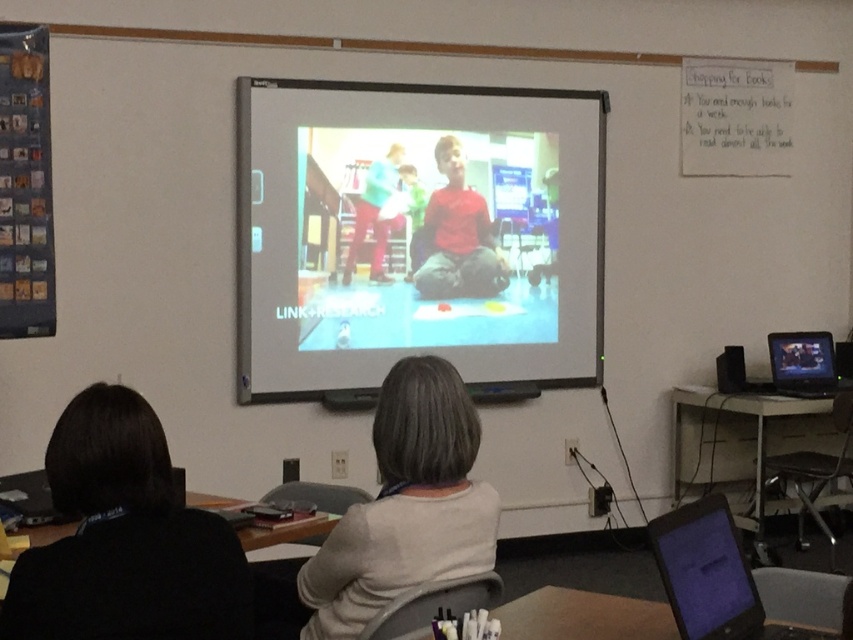
Is point (805, 634) closer to viewer compared to point (374, 180)?

Yes, it is.

Is point (723, 547) farther from camera compared to point (369, 209)?

No, it is in front of (369, 209).

Locate an element on the screen. black glossy laptop at lower right is located at coordinates (712, 577).

Is matte projector screen at center thinner than black glossy laptop at lower right?

No.

Where is `matte projector screen at center`? Image resolution: width=853 pixels, height=640 pixels. matte projector screen at center is located at coordinates (416, 234).

Does white matte sweater at center have a lesser width compared to black glossy laptop at lower right?

Indeed, white matte sweater at center has a lesser width compared to black glossy laptop at lower right.

Is point (392, 538) positioned behind point (682, 605)?

Yes, point (392, 538) is farther from viewer.

The width and height of the screenshot is (853, 640). What do you see at coordinates (405, 506) in the screenshot?
I see `white matte sweater at center` at bounding box center [405, 506].

I want to click on white matte sweater at center, so click(x=405, y=506).